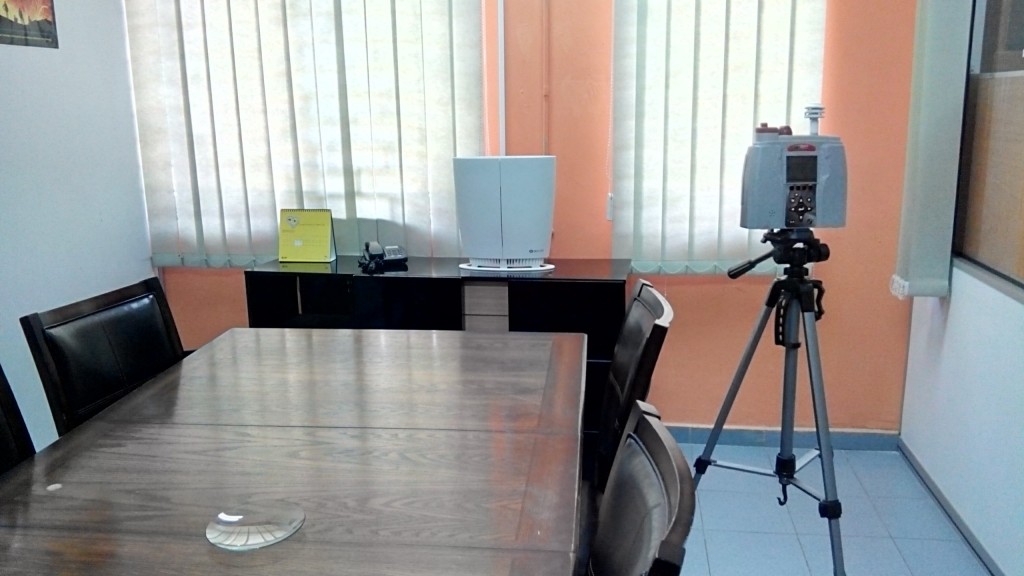
Find the location of a particular element. chairs at conference table is located at coordinates (124, 344), (638, 341), (649, 517), (14, 438).